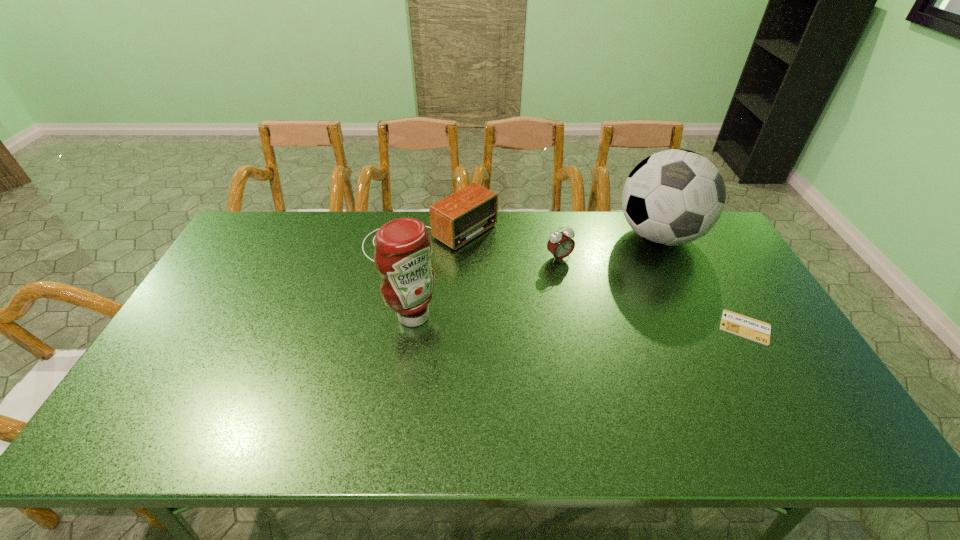
Where is `condiment`? The height and width of the screenshot is (540, 960). condiment is located at coordinates (403, 247).

Find the location of a particular element. The height and width of the screenshot is (540, 960). identity card is located at coordinates (732, 322).

At what (x,y) coordinates should I click in order to perform the action: click on radio receiver. Please return your answer as a coordinate pair (x, y). This screenshot has width=960, height=540. Looking at the image, I should click on (455, 220).

The width and height of the screenshot is (960, 540). Find the location of `soccer ball`. soccer ball is located at coordinates tap(673, 197).

The width and height of the screenshot is (960, 540). I want to click on alarm clock, so click(x=560, y=244).

Locate an element on the screen. Image resolution: width=960 pixels, height=540 pixels. vacant space located 0.370m on the left of the condiment is located at coordinates (259, 316).

Find the location of a particular element. The height and width of the screenshot is (540, 960). vacant area situated on the left of the shortest object is located at coordinates (694, 327).

The width and height of the screenshot is (960, 540). What are the coordinates of `vacant space located on the front-facing side of the radio receiver` in the screenshot? It's located at (532, 289).

Where is `free location located on the front-facing side of the radio receiver`? free location located on the front-facing side of the radio receiver is located at coordinates (524, 285).

This screenshot has width=960, height=540. Identify the location of free region located on the front-facing side of the radio receiver. (545, 298).